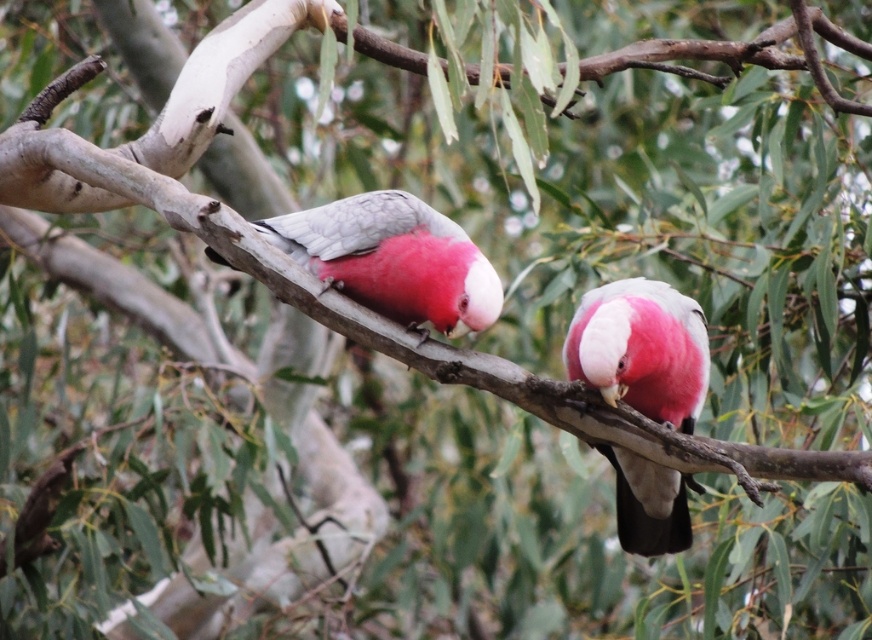
Question: Which of the following is the farthest from the observer?

Choices:
 (A) pink matte parrot at center
 (B) matte pink parrot at center

Answer: (B)

Question: From the image, what is the correct spatial relationship of pink matte parrot at center in relation to matte pink parrot at center?

Choices:
 (A) left
 (B) right

Answer: (B)

Question: Does pink matte parrot at center appear under matte pink parrot at center?

Choices:
 (A) no
 (B) yes

Answer: (B)

Question: From the image, what is the correct spatial relationship of pink matte parrot at center in relation to matte pink parrot at center?

Choices:
 (A) below
 (B) above

Answer: (A)